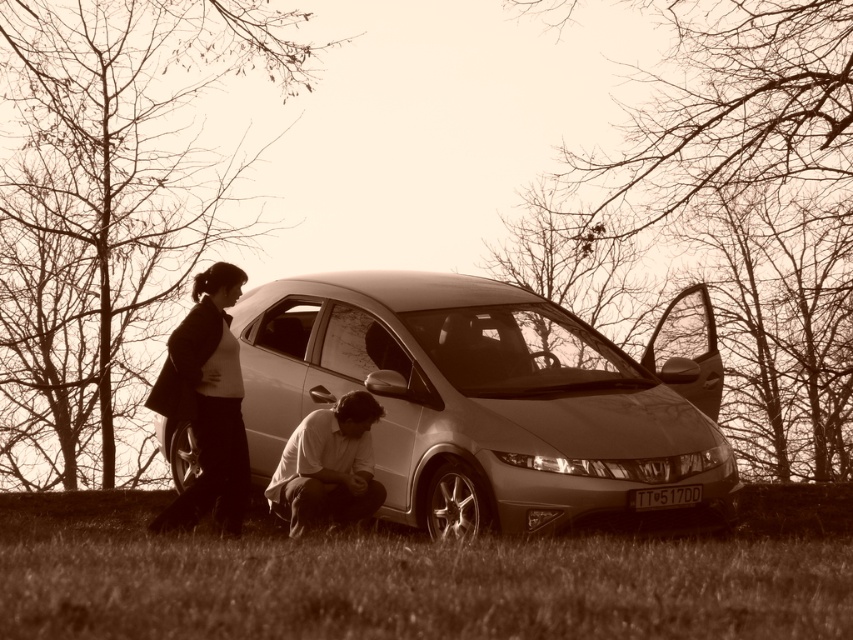
Question: Which point appears closest to the camera in this image?

Choices:
 (A) (820, 499)
 (B) (550, 378)

Answer: (B)

Question: Which point is closer to the camera taking this photo?

Choices:
 (A) (610, 397)
 (B) (807, 509)
 (C) (323, 429)

Answer: (C)

Question: Which point is farther to the camera?

Choices:
 (A) satin silver car at center
 (B) matte white shirt at lower center
 (C) green grass at lower center

Answer: (C)

Question: Is matte black jacket at left above matte white shirt at lower center?

Choices:
 (A) yes
 (B) no

Answer: (A)

Question: Can you confirm if green grass at lower center is wider than matte black jacket at left?

Choices:
 (A) no
 (B) yes

Answer: (A)

Question: Can you confirm if satin silver car at center is bigger than matte white shirt at lower center?

Choices:
 (A) yes
 (B) no

Answer: (A)